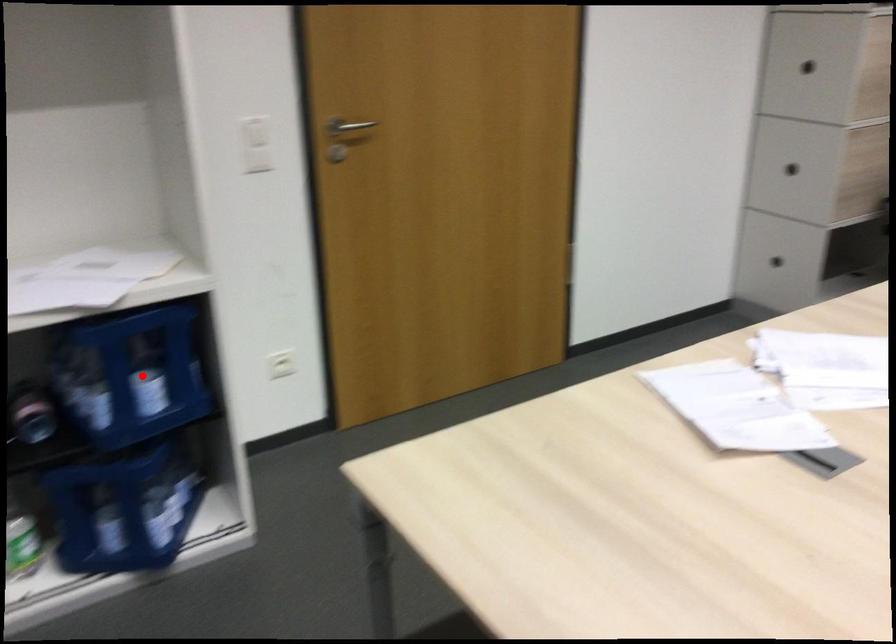
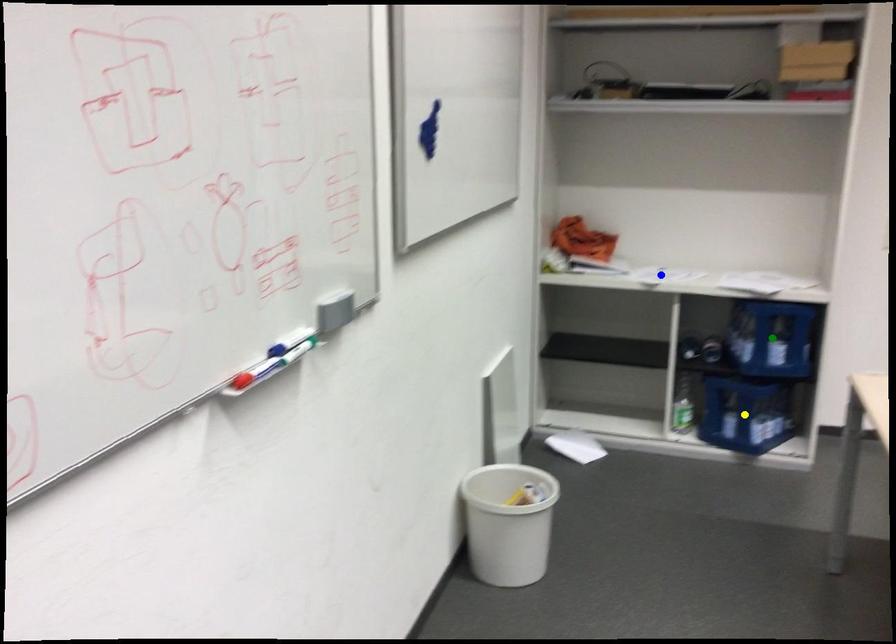
Question: I am providing you with two images of the same scene from different viewpoints. A red point is marked on the first image. You are given multiple points on the second image. Which point in image 2 represents the same 3d spot as the red point in image 1?

Choices:
 (A) green point
 (B) yellow point
 (C) blue point

Answer: (A)